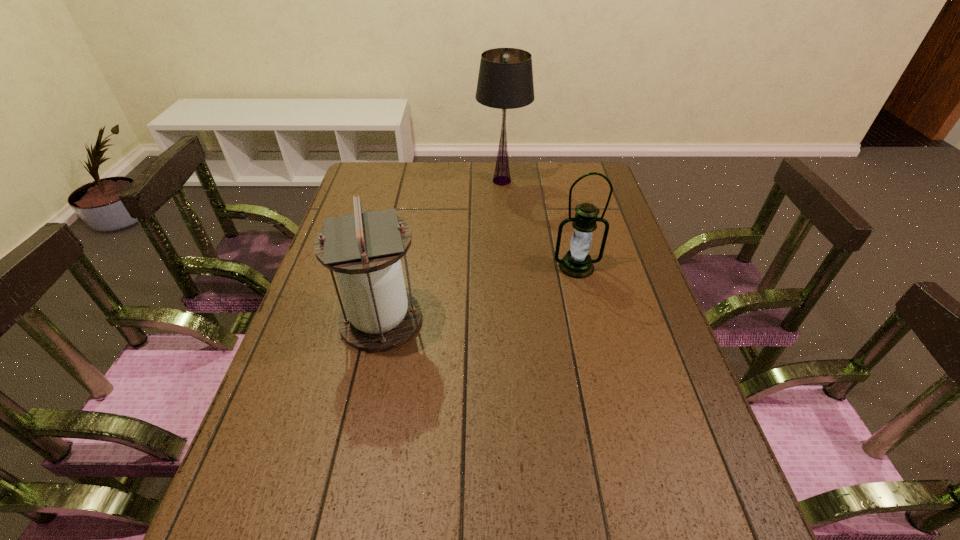
I want to click on vacant space that's between the second object from left to right and the left lantern, so click(442, 251).

Find the location of a particular element. This screenshot has height=540, width=960. free point between the second farthest object and the left lantern is located at coordinates (479, 293).

Find the location of a particular element. This screenshot has width=960, height=540. vacant space that's between the rightmost object and the farthest object is located at coordinates (540, 224).

Locate an element on the screen. This screenshot has width=960, height=540. vacant area that lies between the farther lantern and the nearer lantern is located at coordinates (479, 293).

Where is `free point between the nearer lantern and the lampshade`? free point between the nearer lantern and the lampshade is located at coordinates (442, 251).

Identify which object is the nearest to the leftmost object. Please provide its 2D coordinates. Your answer should be formatted as a tuple, i.e. [(x, y)], where the tuple contains the x and y coordinates of a point satisfying the conditions above.

[(577, 263)]

Find the location of `object that is the second closest one to the second object from left to right`. object that is the second closest one to the second object from left to right is located at coordinates (364, 248).